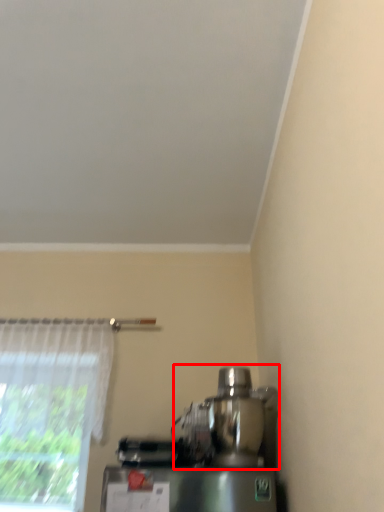
Question: From the image, what is the correct spatial relationship of mixer (annotated by the red box) in relation to curtain?

Choices:
 (A) right
 (B) left

Answer: (A)